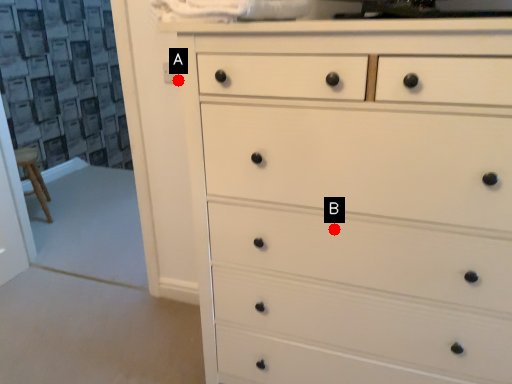
Question: Two points are circled on the image, labeled by A and B beside each circle. Among these points, which one is nearest to the camera?

Choices:
 (A) A is closer
 (B) B is closer

Answer: (B)